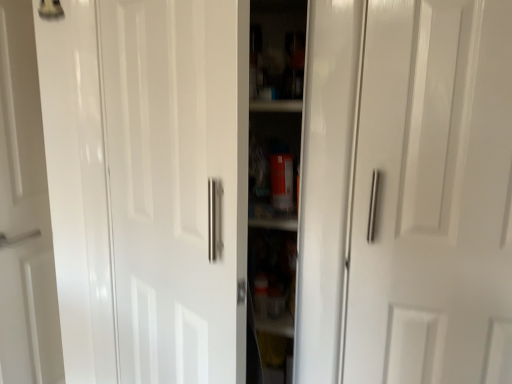
Question: Considering the positions of white glossy door at center, the 2th door viewed from the right, and white glossy door handle at right, the 1th door viewed from the right, in the image, is white glossy door at center, the 2th door viewed from the right, taller or shorter than white glossy door handle at right, the 1th door viewed from the right,?

Choices:
 (A) tall
 (B) short

Answer: (A)

Question: Does point (158, 274) appear closer or farther from the camera than point (374, 281)?

Choices:
 (A) closer
 (B) farther

Answer: (B)

Question: Is white glossy door at center, the 2th door viewed from the right, in front of or behind white glossy door handle at right, the 1th door viewed from the right, in the image?

Choices:
 (A) behind
 (B) front

Answer: (B)

Question: From their relative heights in the image, would you say white glossy door handle at right, the 1th door viewed from the right, is taller or shorter than white glossy door at center, acting as the first door starting from the left?

Choices:
 (A) tall
 (B) short

Answer: (B)

Question: Visually, is white glossy door handle at right, the 1th door viewed from the right, positioned to the left or to the right of white glossy door at center, the 2th door viewed from the right?

Choices:
 (A) right
 (B) left

Answer: (A)

Question: In terms of size, does white glossy door handle at right, which is the second door from left to right, appear bigger or smaller than white glossy door at center, the 2th door viewed from the right?

Choices:
 (A) big
 (B) small

Answer: (B)

Question: From a real-world perspective, is white glossy door handle at right, the 1th door viewed from the right, above or below white glossy door at center, the 2th door viewed from the right?

Choices:
 (A) above
 (B) below

Answer: (A)